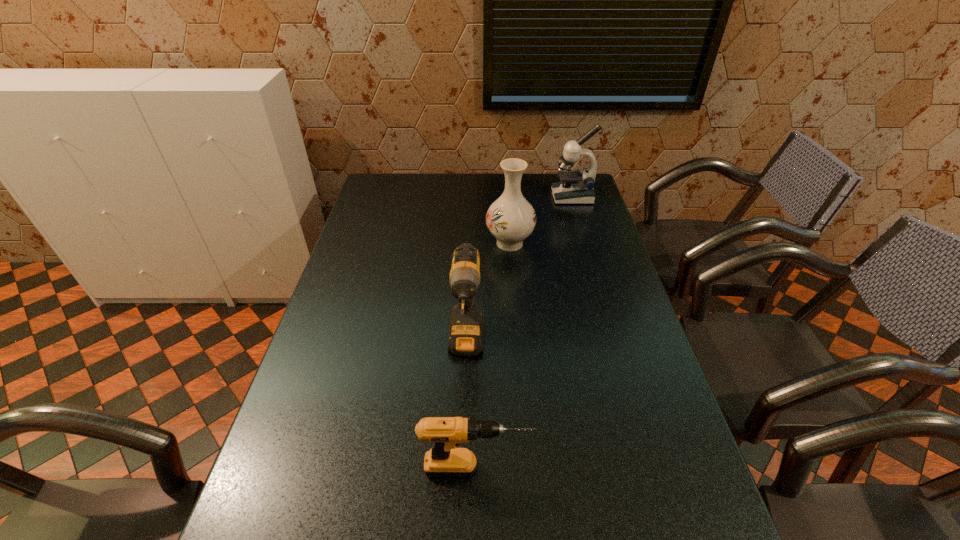
This screenshot has width=960, height=540. What are the coordinates of `vacant space at the far right corner of the desktop` in the screenshot? It's located at (555, 176).

Identify the location of unoccupied area between the microscope and the nearest object. (524, 333).

I want to click on vacant space that is in between the shorter drill and the farther drill, so click(x=471, y=407).

At what (x,y) coordinates should I click in order to perform the action: click on free space between the vase and the taller drill. Please return your answer as a coordinate pair (x, y). This screenshot has width=960, height=540. Looking at the image, I should click on (488, 294).

Locate an element on the screen. The width and height of the screenshot is (960, 540). vacant space that's between the farther drill and the shorter drill is located at coordinates (471, 407).

I want to click on free area in between the vase and the taller drill, so click(488, 294).

This screenshot has width=960, height=540. What are the coordinates of `free space between the nearer drill and the second nearest object` in the screenshot? It's located at (471, 407).

At what (x,y) coordinates should I click in order to perform the action: click on empty space that is in between the taller drill and the farthest object. Please return your answer as a coordinate pair (x, y). The image size is (960, 540). Looking at the image, I should click on (519, 271).

Find the location of `vacant space that's between the third farthest object and the nearest object`. vacant space that's between the third farthest object and the nearest object is located at coordinates (471, 407).

Locate an element on the screen. This screenshot has height=540, width=960. vacant point located between the taller drill and the farthest object is located at coordinates (519, 271).